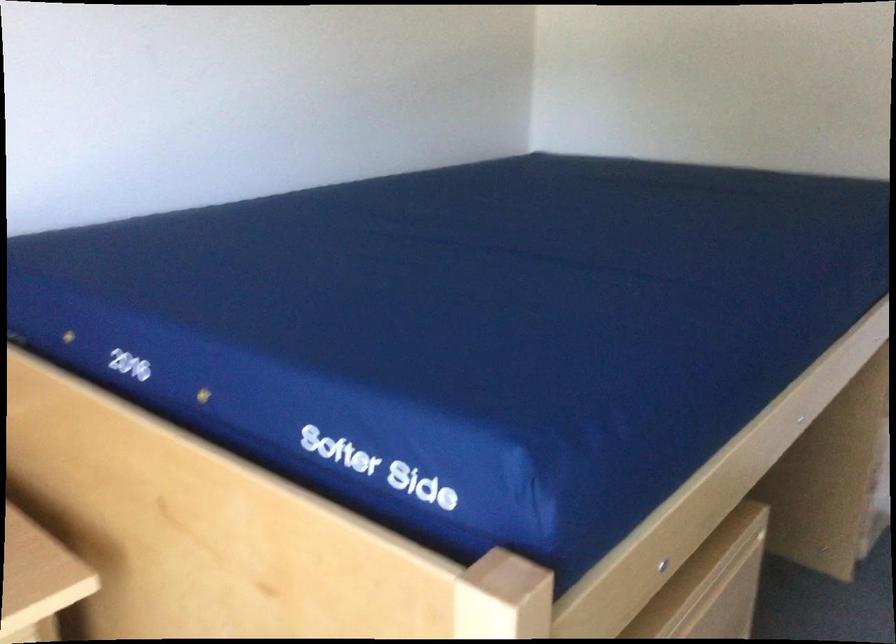
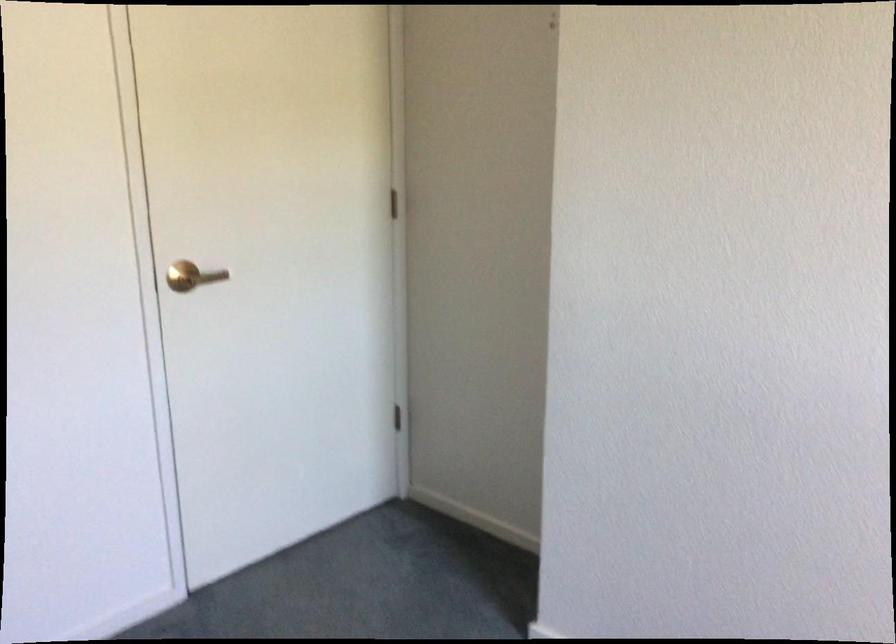
Question: The camera is either moving clockwise (left) or counter-clockwise (right) around the object. The first image is from the beginning of the video and the second image is from the end. Is the camera moving left or right when shooting the video?

Choices:
 (A) Left
 (B) Right

Answer: (A)